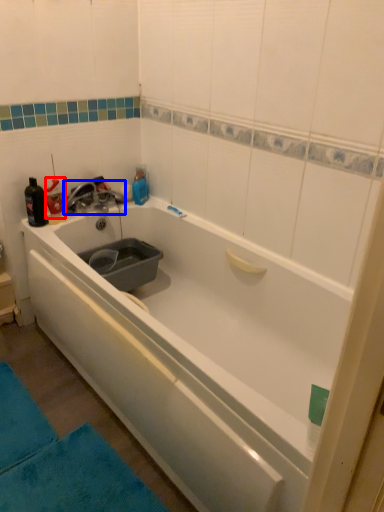
Question: Which point is further to the camera, bottle (highlighted by a red box) or tap (highlighted by a blue box)?

Choices:
 (A) bottle
 (B) tap

Answer: (B)